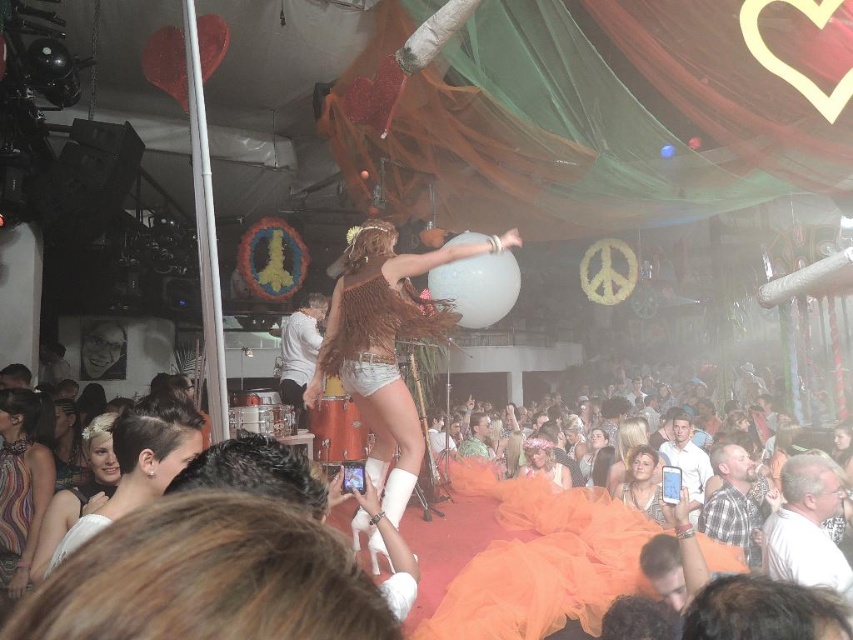
You are a photographer at the event and want to capture both the multicolored sequined dress at lower left and the matte gold dress at center in a single frame. Which dress should you focus on to ensure both are visible without zooming in too much?

The multicolined sequined dress at lower left is smaller than the matte gold dress at center, so focusing on the matte gold dress at center would allow both to be visible without excessive zooming.

You are a photographer at the event and want to capture a clear photo of both the multicolored sequined dress at lower left and the matte white dress at lower left. Which dress should you focus on to ensure both are in focus?

You should focus on the multicolored sequined dress at lower left because it is closer to the viewer than the matte white dress at lower left, so focusing on it will keep both in focus.

Looking at this image, you are standing at the origin point of the coordinate system in the image. You want to move towards the multicolored sequined dress at lower left. Which direction should you move in terms of x and y coordinates?

The multicolored sequined dress at lower left is located at coordinates x 0.792 and y 0.016, so you should move towards the positive x and negative y direction.